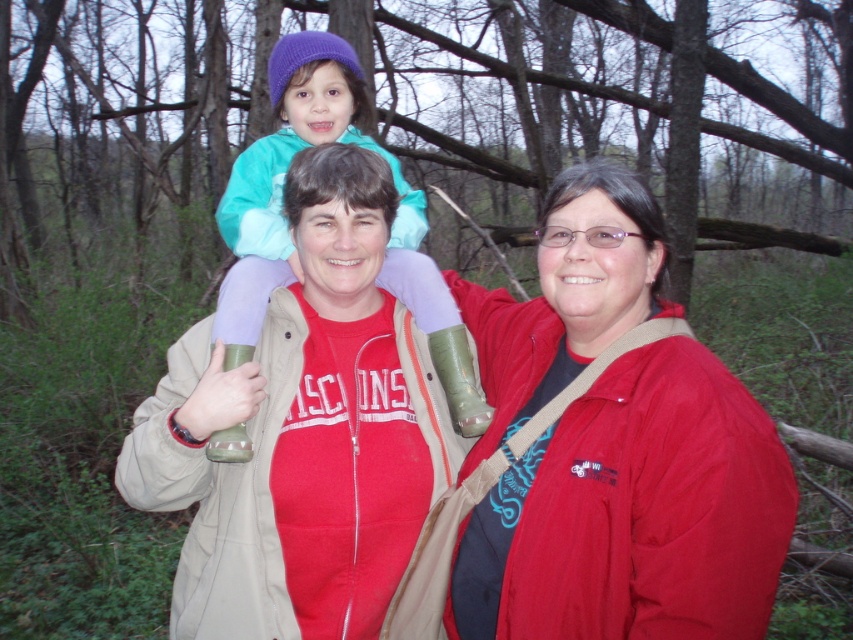
You are a photographer taking a picture of the matte green rubber boots at center. What coordinates should you aim your camera at to capture the boots in the center of the photo?

You should aim your camera at point [302,433] to center the matte green rubber boots at center in the photo.

What is located at the point with coordinates (302, 433) in the image?

The point at coordinates (302, 433) is located on matte green rubber boots at center.